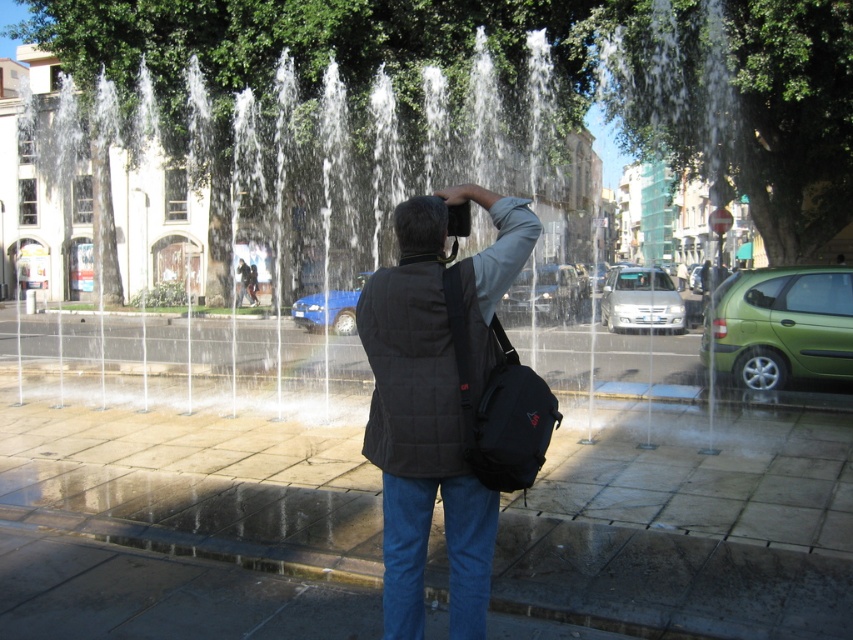
Question: Is dark gray quilted vest at center closer to camera compared to dark gray fabric head at center?

Choices:
 (A) no
 (B) yes

Answer: (B)

Question: Is dark gray quilted vest at center bigger than dark gray fabric head at center?

Choices:
 (A) no
 (B) yes

Answer: (B)

Question: Among these objects, which one is nearest to the camera?

Choices:
 (A) dark gray quilted vest at center
 (B) dark gray fabric head at center

Answer: (A)

Question: Which object appears farthest from the camera in this image?

Choices:
 (A) dark gray fabric head at center
 (B) dark gray quilted vest at center

Answer: (A)

Question: Considering the relative positions of dark gray quilted vest at center and dark gray fabric head at center in the image provided, where is dark gray quilted vest at center located with respect to dark gray fabric head at center?

Choices:
 (A) above
 (B) below

Answer: (B)